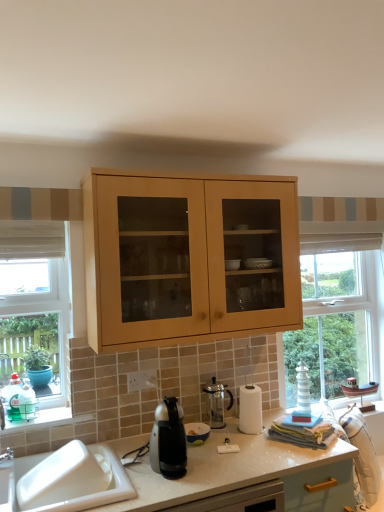
In order to click on vacant space in front of satin black coffee maker at center in this screenshot , I will do `click(166, 489)`.